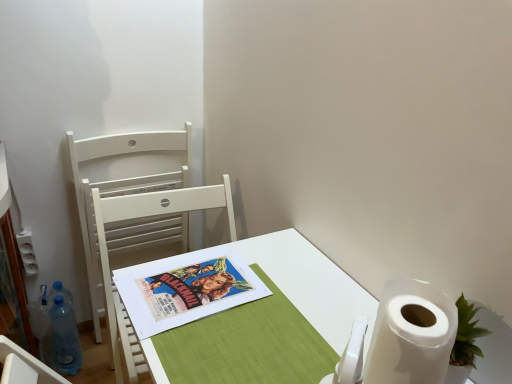
Question: From the image's perspective, is white wood chair at left, the 2th chair positioned from the back, on top of colorful paper poster at center?

Choices:
 (A) yes
 (B) no

Answer: (B)

Question: Can you confirm if white wood chair at left, the 1th chair when ordered from front to back, is taller than colorful paper poster at center?

Choices:
 (A) no
 (B) yes

Answer: (B)

Question: Is white wood chair at left, the 1th chair when ordered from front to back, completely or partially outside of colorful paper poster at center?

Choices:
 (A) yes
 (B) no

Answer: (A)

Question: Can you confirm if white wood chair at left, the 1th chair when ordered from front to back, is smaller than colorful paper poster at center?

Choices:
 (A) yes
 (B) no

Answer: (B)

Question: Is white wood chair at left, the 1th chair when ordered from front to back, not close to colorful paper poster at center?

Choices:
 (A) yes
 (B) no

Answer: (B)

Question: Does white wood chair at left, the 2th chair positioned from the back, have a lesser height compared to colorful paper poster at center?

Choices:
 (A) no
 (B) yes

Answer: (A)

Question: Does white paper desk at center have a larger size compared to colorful paper poster at center?

Choices:
 (A) no
 (B) yes

Answer: (B)

Question: Can you confirm if white paper desk at center is shorter than colorful paper poster at center?

Choices:
 (A) yes
 (B) no

Answer: (B)

Question: Is white paper desk at center thinner than colorful paper poster at center?

Choices:
 (A) no
 (B) yes

Answer: (A)

Question: Can you confirm if white paper desk at center is positioned to the left of colorful paper poster at center?

Choices:
 (A) no
 (B) yes

Answer: (A)

Question: Is white paper desk at center facing towards colorful paper poster at center?

Choices:
 (A) yes
 (B) no

Answer: (B)

Question: Is white paper desk at center touching colorful paper poster at center?

Choices:
 (A) no
 (B) yes

Answer: (A)

Question: Is colorful paper poster at center far from white wood chair at left, which ranks as the second chair in front-to-back order?

Choices:
 (A) no
 (B) yes

Answer: (A)